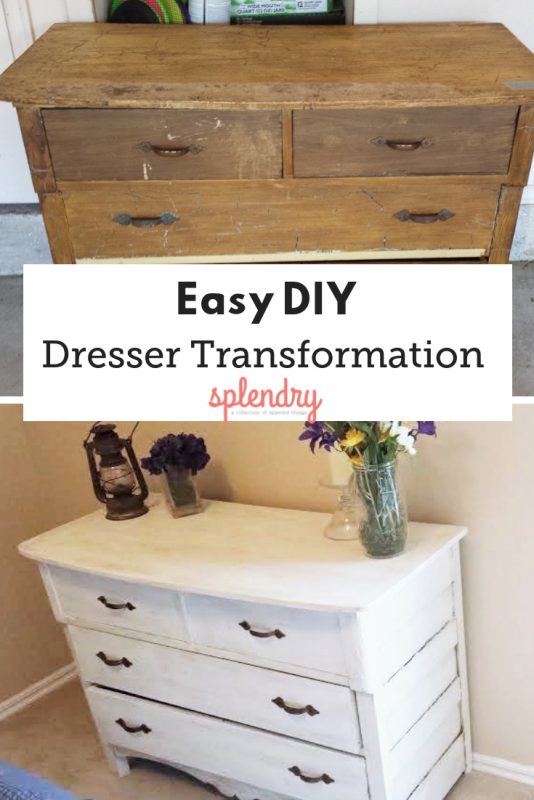
What are the coordinates of `vase` in the screenshot? It's located at (178, 472), (384, 481).